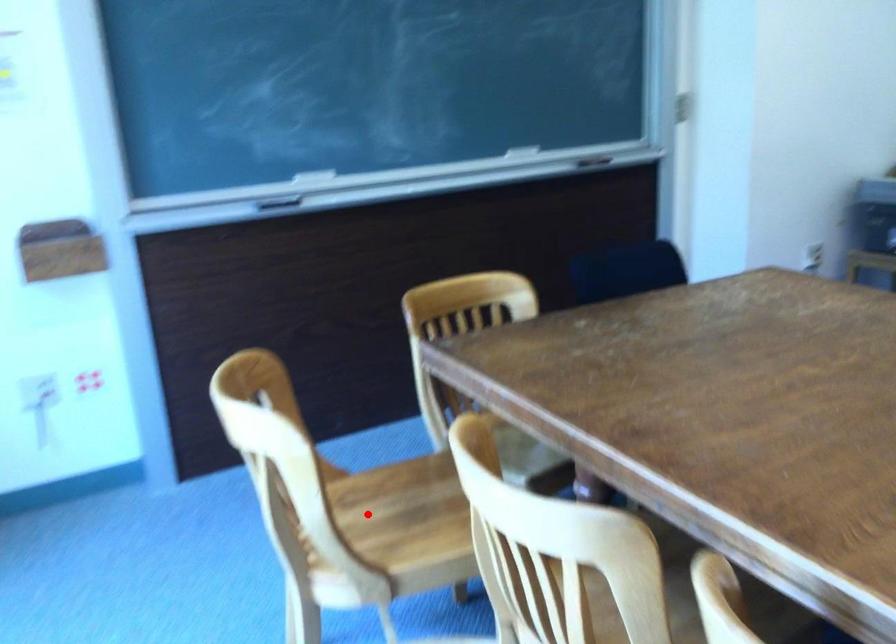
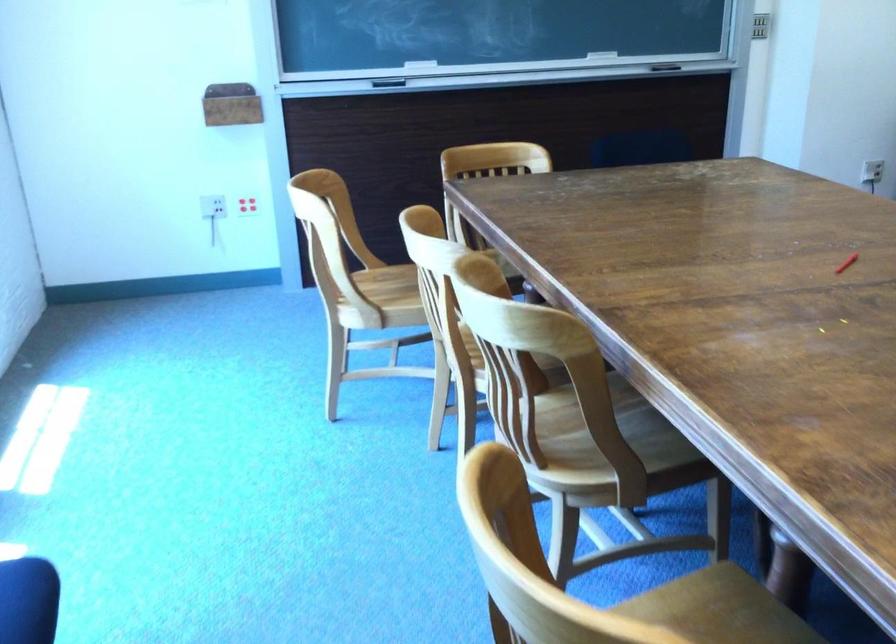
The point at the highlighted location is marked in the first image. Where is the corresponding point in the second image?

(393, 286)